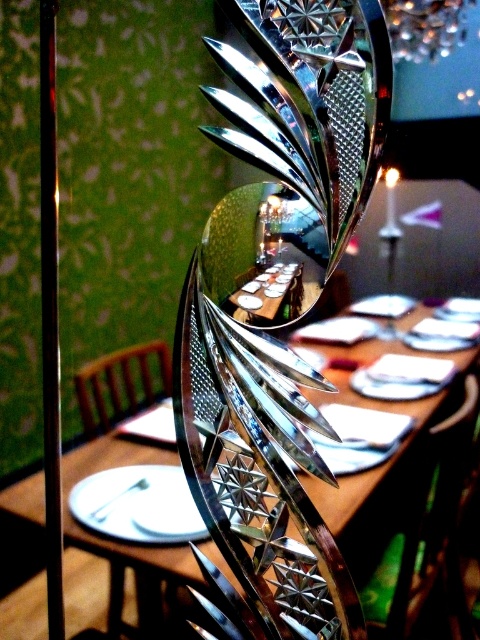
You are a guest at a formal dinner. You notice the polished silver sculpture at center and the metallic textured lamp at upper right. Which object is closer to the ceiling?

The metallic textured lamp at upper right is closer to the ceiling because it is positioned above the polished silver sculpture at center.

You are a guest at a formal dinner and want to place your napkin on the closest object to the dining table. Which object should you choose between the polished silver sculpture at center and the metallic textured lamp at upper right?

The metallic textured lamp at upper right is closer to the dining table than the polished silver sculpture at center, so you should place your napkin on the metallic textured lamp at upper right.